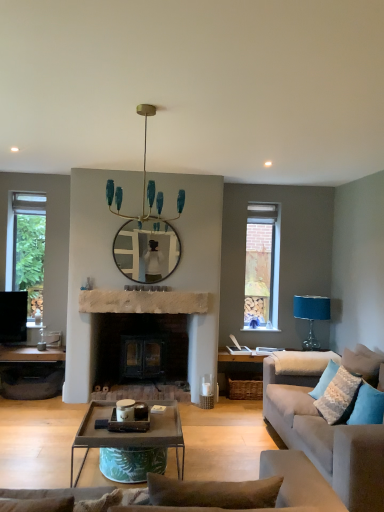
Question: Is blue fabric pillow at lower right, placed as the 2th pillow when sorted from back to front, taller or shorter than metallic silver tray at lower left?

Choices:
 (A) short
 (B) tall

Answer: (B)

Question: Would you say blue fabric pillow at lower right, marked as the first pillow in a front-to-back arrangement, is to the left or to the right of metallic silver tray at lower left in the picture?

Choices:
 (A) right
 (B) left

Answer: (A)

Question: Estimate the real-world distances between objects in this image. Which object is closer to the teal glass chandelier at upper center?

Choices:
 (A) light gray fabric couch at right
 (B) textured blue pillow at right, the second pillow viewed from the front
 (C) blue fabric pillow at lower right, placed as the 2th pillow when sorted from back to front
 (D) blue fabric lampshade at right
 (E) metallic gray coffee table at center

Answer: (E)

Question: Which is nearer to the metallic silver tray at lower left?

Choices:
 (A) blue fabric pillow at lower right, marked as the first pillow in a front-to-back arrangement
 (B) blue fabric lampshade at right
 (C) textured blue pillow at right, the second pillow viewed from the front
 (D) light gray fabric couch at right
 (E) metallic gray coffee table at center

Answer: (E)